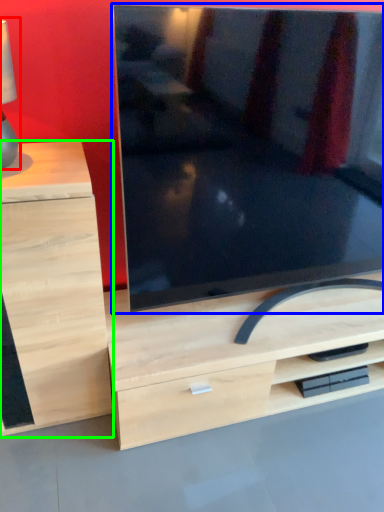
Question: Considering the real-world distances, which object is farthest from table lamp (highlighted by a red box)? television (highlighted by a blue box) or chest of drawers (highlighted by a green box)?

Choices:
 (A) television
 (B) chest of drawers

Answer: (A)